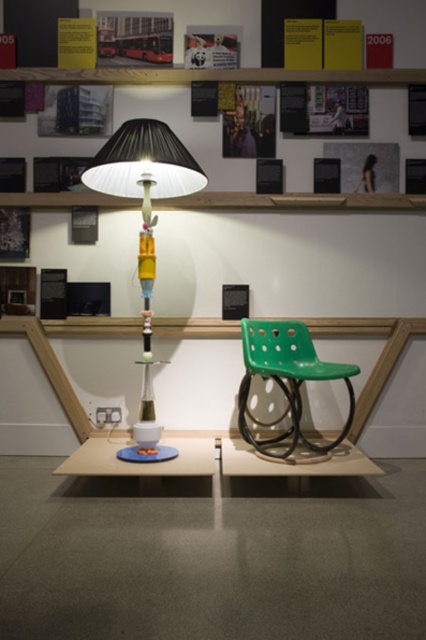
You are an interior designer assessing the layout of the indoor display. You need to determine if the matte black lampshade at center can be placed on top of the green plastic chair at center without exceeding the chair height. Can it fit?

The matte black lampshade at center is taller than the green plastic chair at center, so placing it on top would exceed the chair height and not fit properly.

You are an interior designer arranging furniture in the room shown. You need to place a new sofa that requires a clear path between the matte black lampshade at upper center and the matte white table at center. Is there enough space for the sofa to pass through?

The matte white table at center is behind the matte black lampshade at upper center, so there is no space between them for the sofa to pass through.

You are an interior designer assessing the layout of this exhibition space. You need to determine if the green plastic chair at center can fit under the matte black lampshade at center without touching it. Based on their sizes, what would you advise?

The matte black lampshade at center is bigger than the green plastic chair at center, so there should be enough space for the chair to fit underneath without touching the lampshade.